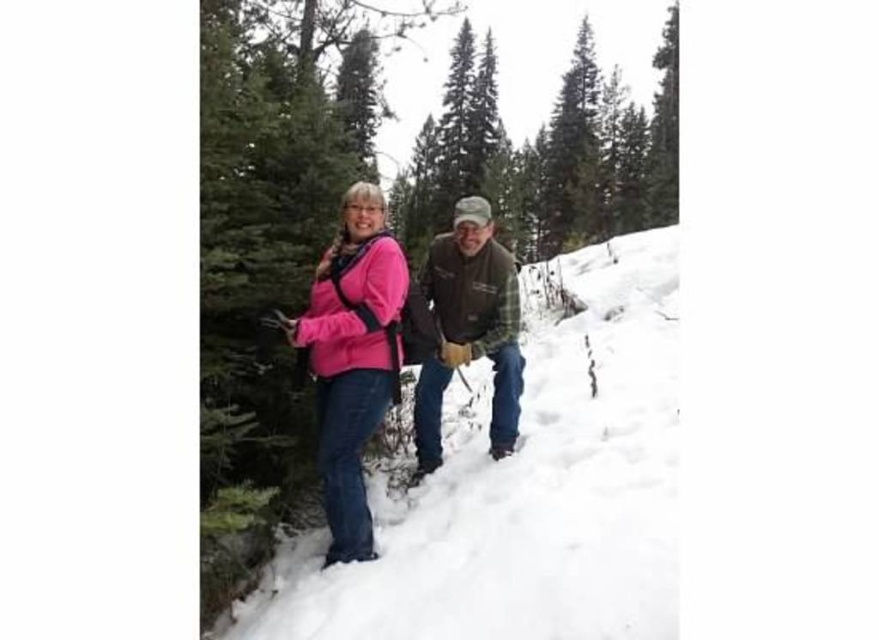
Question: Is white fluffy snow at center wider than brown leather jacket at center?

Choices:
 (A) no
 (B) yes

Answer: (B)

Question: Estimate the real-world distances between objects in this image. Which object is farther from the brown leather jacket at center?

Choices:
 (A) pink fleece jacket at center
 (B) white fluffy snow at center

Answer: (B)

Question: Is pink fleece jacket at center positioned behind brown leather jacket at center?

Choices:
 (A) no
 (B) yes

Answer: (A)

Question: Estimate the real-world distances between objects in this image. Which object is farther from the pink fleece jacket at center?

Choices:
 (A) white fluffy snow at center
 (B) brown leather jacket at center

Answer: (A)

Question: Among these points, which one is nearest to the camera?

Choices:
 (A) (465, 321)
 (B) (647, 413)
 (C) (300, 336)

Answer: (C)

Question: Is white fluffy snow at center in front of brown leather jacket at center?

Choices:
 (A) yes
 (B) no

Answer: (A)